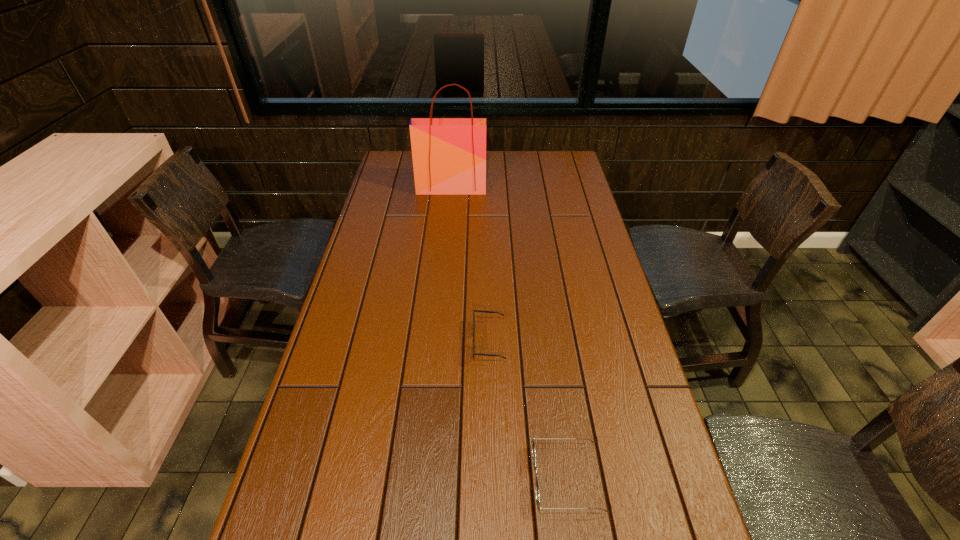
You are a GUI agent. You are given a task and a screenshot of the screen. Output one action in this format:
    pyautogui.click(x=<x>, y=<y>)
    Task: Click on the free area in between the rightmost sunglasses and the tallest object
    The width and height of the screenshot is (960, 540).
    Given the screenshot: What is the action you would take?
    pyautogui.click(x=510, y=333)

I want to click on vacant space that is in between the farthest sunglasses and the second nearest sunglasses, so click(x=528, y=410).

Image resolution: width=960 pixels, height=540 pixels. Find the location of `free space between the farthest object and the rightmost object`. free space between the farthest object and the rightmost object is located at coordinates (510, 333).

Locate an element on the screen. Image resolution: width=960 pixels, height=540 pixels. free spot between the third farthest object and the second sunglasses from right to left is located at coordinates tap(528, 410).

What are the coordinates of `vacant space that's between the farthest object and the third nearest object` in the screenshot? It's located at (470, 265).

Choose which object is the third nearest neighbor to the farthest sunglasses. Please provide its 2D coordinates. Your answer should be formatted as a tuple, i.e. [(x, y)], where the tuple contains the x and y coordinates of a point satisfying the conditions above.

[(449, 154)]

You are a GUI agent. You are given a task and a screenshot of the screen. Output one action in this format:
    pyautogui.click(x=<x>, y=<y>)
    Task: Click on the third closest object to the nearest object
    The width and height of the screenshot is (960, 540).
    Given the screenshot: What is the action you would take?
    pyautogui.click(x=449, y=154)

The width and height of the screenshot is (960, 540). What are the coordinates of `the closest sunglasses to the nearest object` in the screenshot? It's located at (533, 443).

In order to click on sunglasses object that ranks as the third closest to the tallest object in this screenshot , I will do `click(386, 523)`.